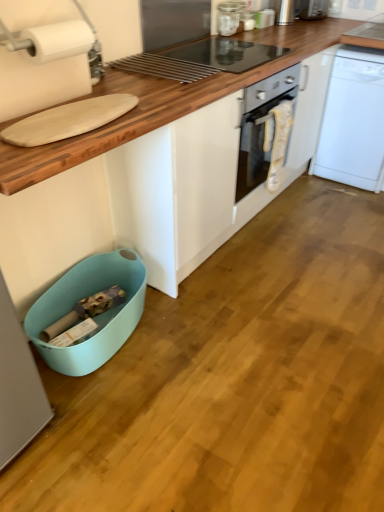
Identify the location of free point in front of teal plastic dish washer at lower left. Image resolution: width=384 pixels, height=512 pixels. (105, 424).